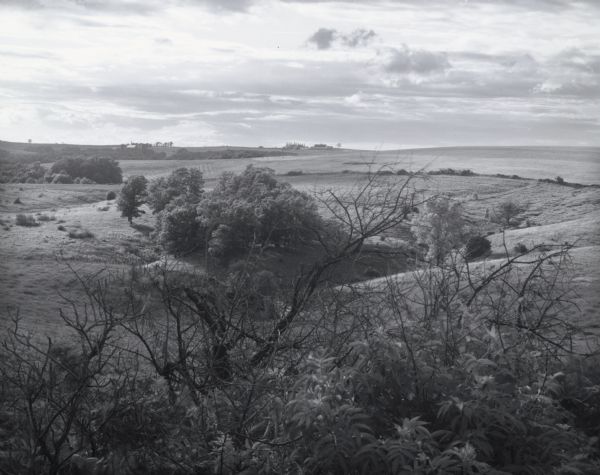
Identify the location of corner. The width and height of the screenshot is (600, 475). (577, 459), (15, 462), (11, 13), (589, 8).